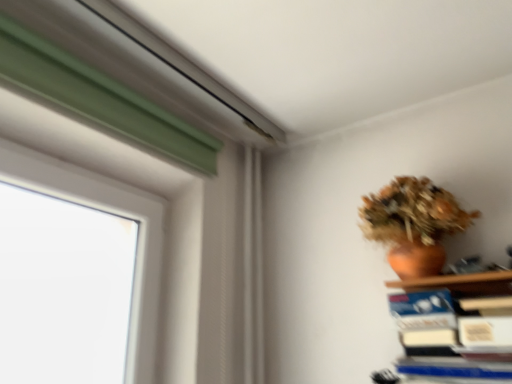
Question: From the image's perspective, relative to blue hardcover book at lower right, is terracotta clay vase at upper right above or below?

Choices:
 (A) below
 (B) above

Answer: (B)

Question: Visually, is terracotta clay vase at upper right positioned to the left or to the right of blue hardcover book at lower right?

Choices:
 (A) right
 (B) left

Answer: (B)

Question: Does point (437, 236) appear closer or farther from the camera than point (425, 360)?

Choices:
 (A) closer
 (B) farther

Answer: (B)

Question: Would you say blue hardcover book at lower right is inside or outside terracotta clay vase at upper right?

Choices:
 (A) inside
 (B) outside

Answer: (B)

Question: From a real-world perspective, is blue hardcover book at lower right positioned above or below terracotta clay vase at upper right?

Choices:
 (A) above
 (B) below

Answer: (B)

Question: Is blue hardcover book at lower right in front of or behind terracotta clay vase at upper right in the image?

Choices:
 (A) behind
 (B) front

Answer: (B)

Question: In the image, is blue hardcover book at lower right on the left side or the right side of terracotta clay vase at upper right?

Choices:
 (A) left
 (B) right

Answer: (B)